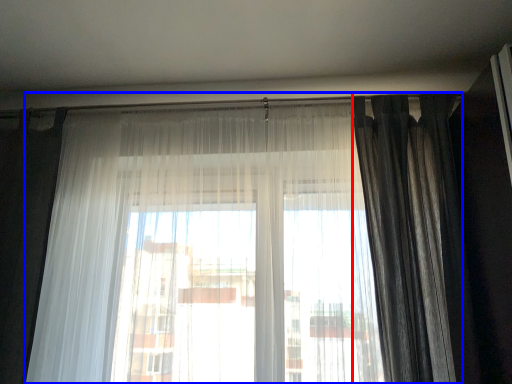
Question: Which point is closer to the camera, curtain (highlighted by a red box) or curtain (highlighted by a blue box)?

Choices:
 (A) curtain
 (B) curtain

Answer: (B)